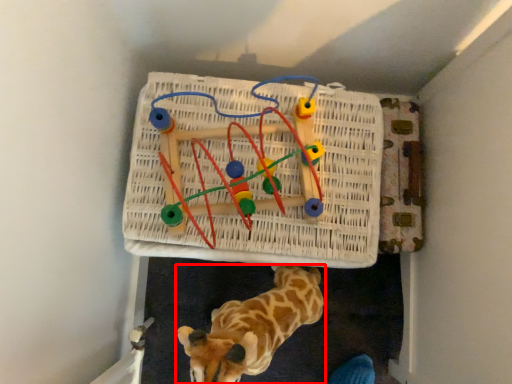
Question: Where is giraffe (annotated by the red box) located in relation to toy in the image?

Choices:
 (A) left
 (B) right

Answer: (B)